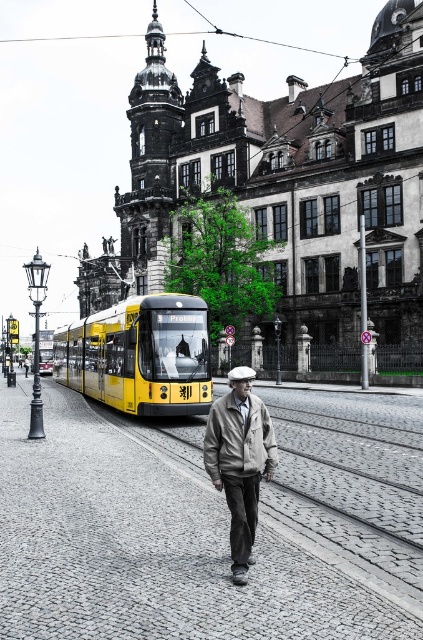
Which is above, yellow matte bus at center or khaki fabric jacket at center?

yellow matte bus at center

Image resolution: width=423 pixels, height=640 pixels. What do you see at coordinates (140, 355) in the screenshot?
I see `yellow matte bus at center` at bounding box center [140, 355].

This screenshot has height=640, width=423. In order to click on yellow matte bus at center in this screenshot , I will do `click(140, 355)`.